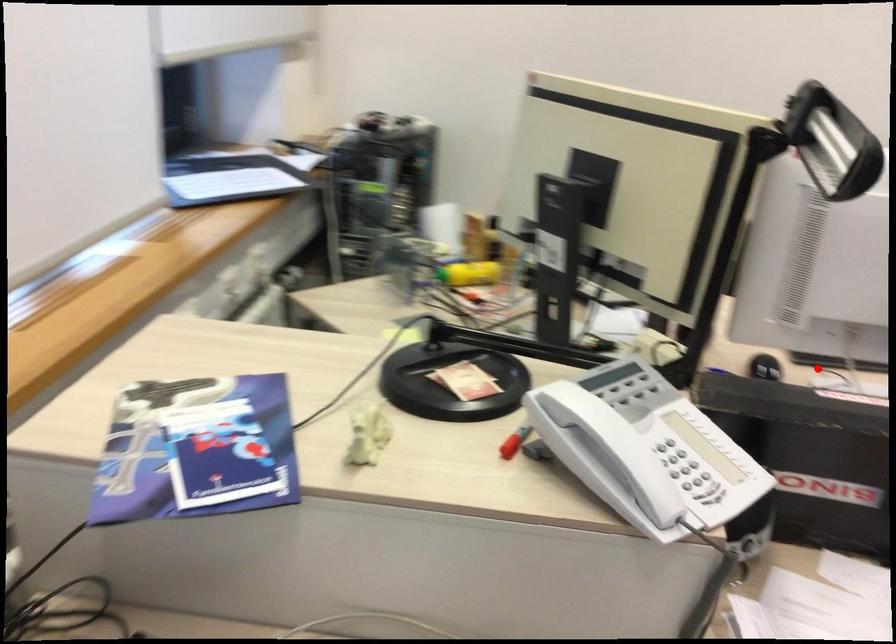
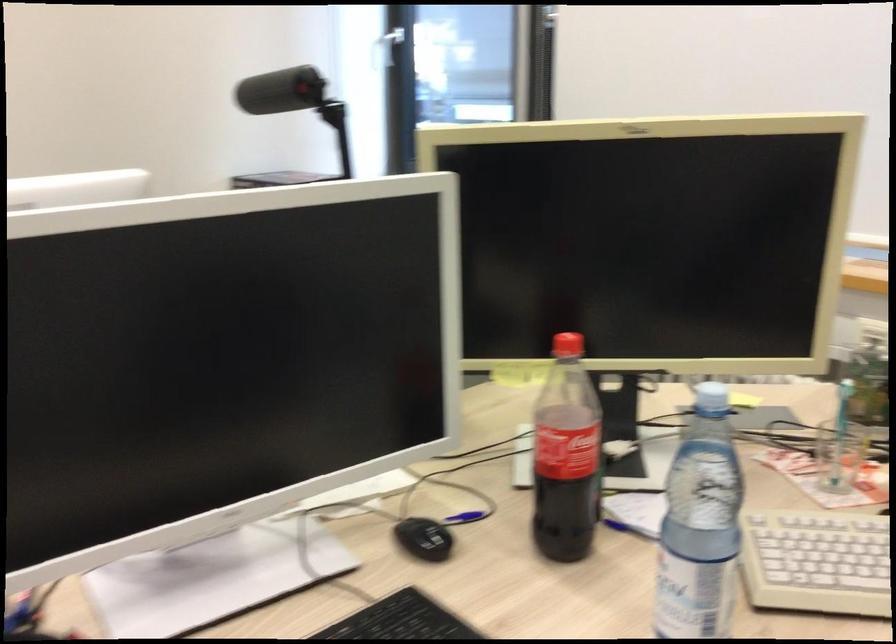
Find the pixel in the second image that matches the highlighted location in the first image.

(401, 620)